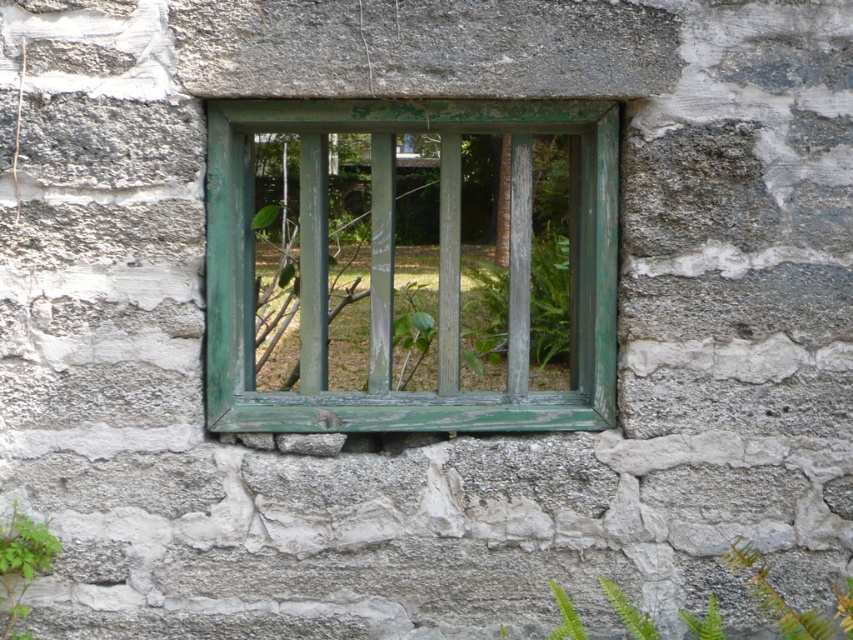
Between green weathered wood at center and green leafy plant at lower left, which one is positioned lower?

Positioned lower is green leafy plant at lower left.

Does green weathered wood at center appear over green leafy plant at lower left?

Correct, green weathered wood at center is located above green leafy plant at lower left.

Between point (453, 276) and point (16, 532), which one is positioned behind?

The point (453, 276) is behind.

Where is `green weathered wood at center`? The height and width of the screenshot is (640, 853). green weathered wood at center is located at coordinates (392, 268).